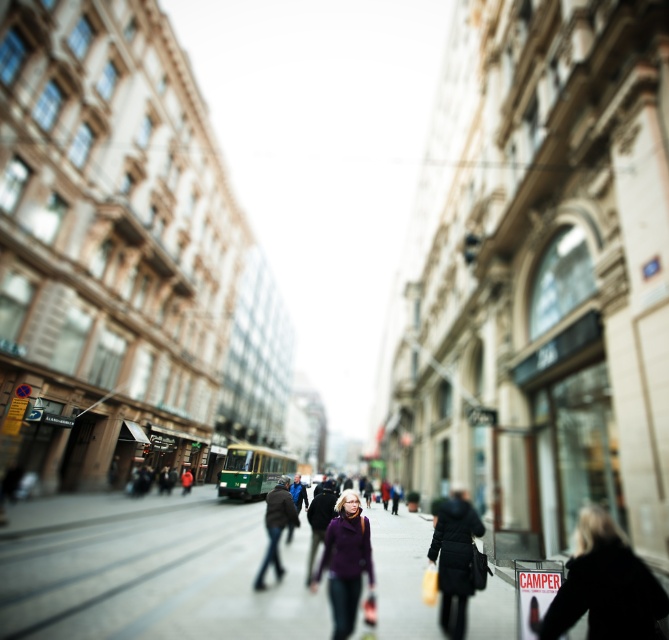
Does point (607, 541) come in front of point (337, 568)?

Yes, point (607, 541) is in front of point (337, 568).

Is point (581, 518) less distant than point (349, 589)?

Yes.

This screenshot has width=669, height=640. I want to click on silhouette leather jacket at lower right, so click(605, 586).

Can you confirm if smooth concrete sidewalk at center is positioned to the left of silhouette leather jacket at lower right?

Indeed, smooth concrete sidewalk at center is positioned on the left side of silhouette leather jacket at lower right.

Which is more to the right, smooth concrete sidewalk at center or silhouette leather jacket at lower right?

silhouette leather jacket at lower right

Which is in front, point (294, 592) or point (605, 572)?

Point (605, 572)

Identify the location of smooth concrete sidewalk at center. The height and width of the screenshot is (640, 669). (151, 570).

At what (x,y) coordinates should I click in order to perform the action: click on smooth concrete sidewalk at center. Please return your answer as a coordinate pair (x, y). This screenshot has width=669, height=640. Looking at the image, I should click on (151, 570).

Which is above, smooth concrete sidewalk at center or purple woolen sweater at center?

purple woolen sweater at center is higher up.

Who is more forward, (215, 588) or (361, 572)?

Positioned in front is point (361, 572).

Locate an element on the screen. smooth concrete sidewalk at center is located at coordinates (151, 570).